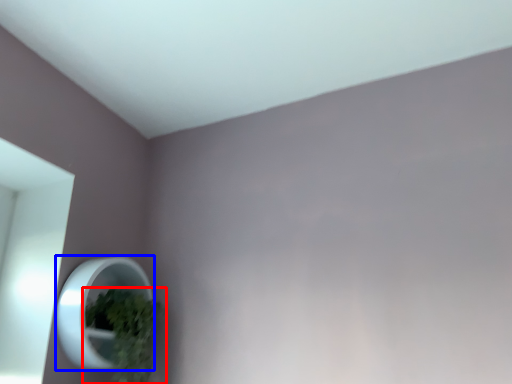
Question: Among these objects, which one is nearest to the camera, houseplant (highlighted by a red box) or mirror (highlighted by a blue box)?

Choices:
 (A) houseplant
 (B) mirror

Answer: (B)